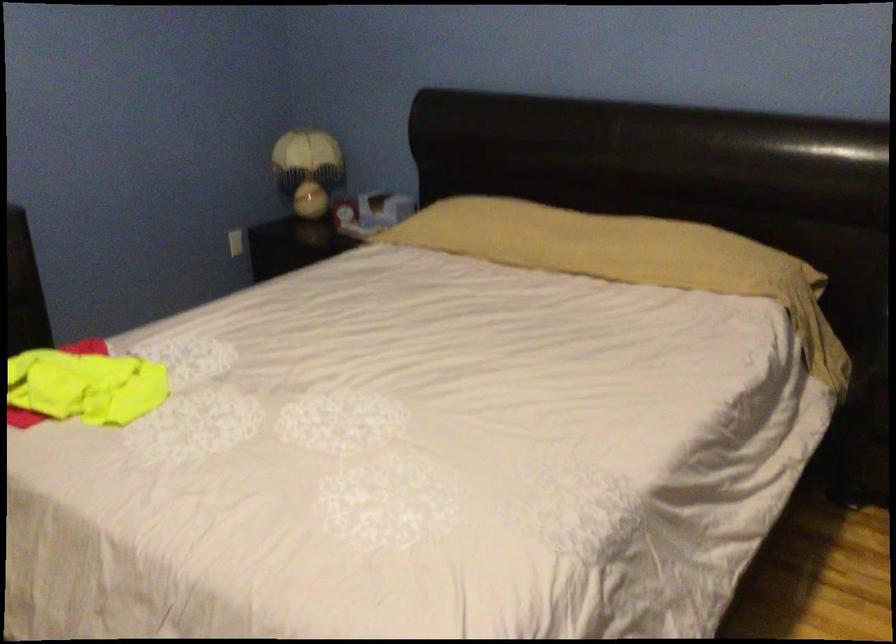
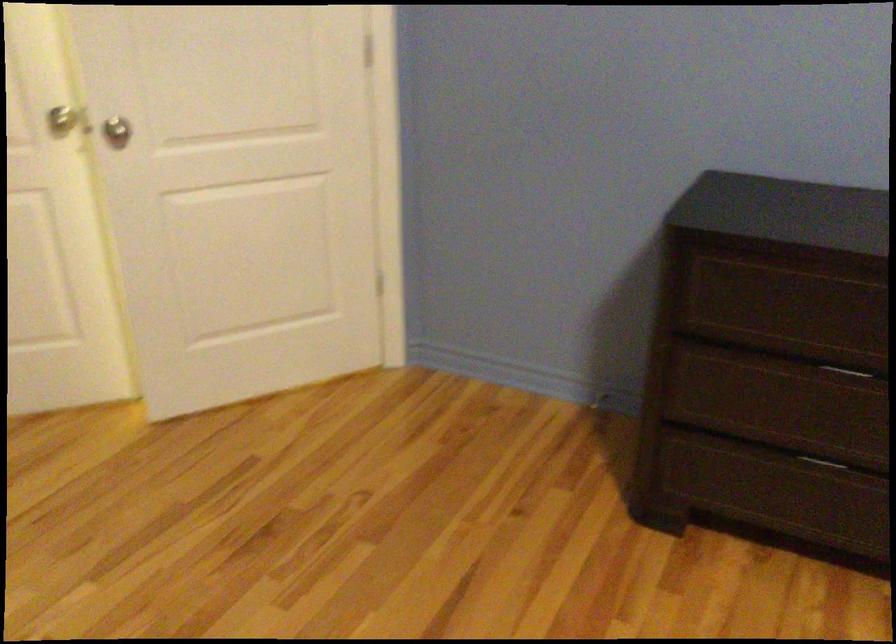
First-person continuous shooting, in which direction is the camera rotating?

The camera's rotation is toward left-down.